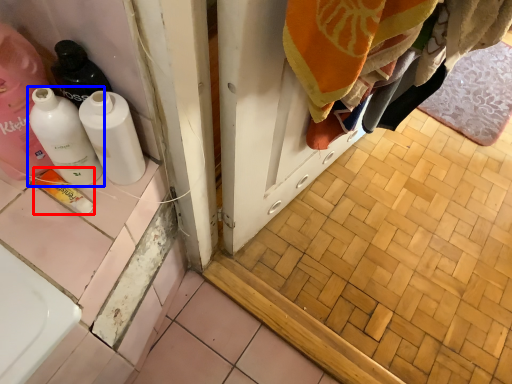
Question: Which point is closer to the camera, product (highlighted by a red box) or bottle (highlighted by a blue box)?

Choices:
 (A) product
 (B) bottle

Answer: (B)